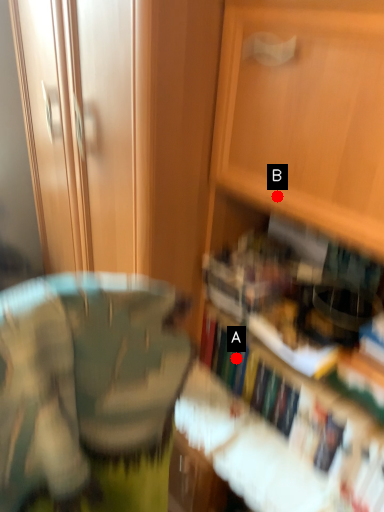
Question: Two points are circled on the image, labeled by A and B beside each circle. Which of the following is the closest to the observer?

Choices:
 (A) A is closer
 (B) B is closer

Answer: (B)